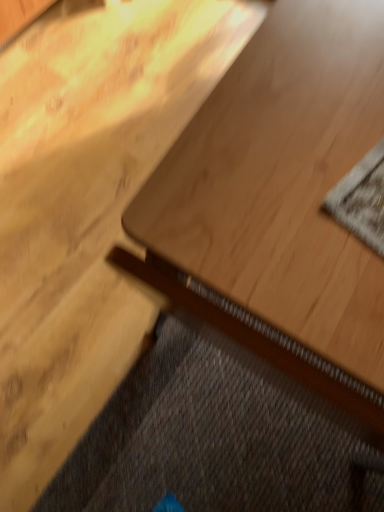
What are the coordinates of `free location to the left of light wood table at center` in the screenshot? It's located at (79, 230).